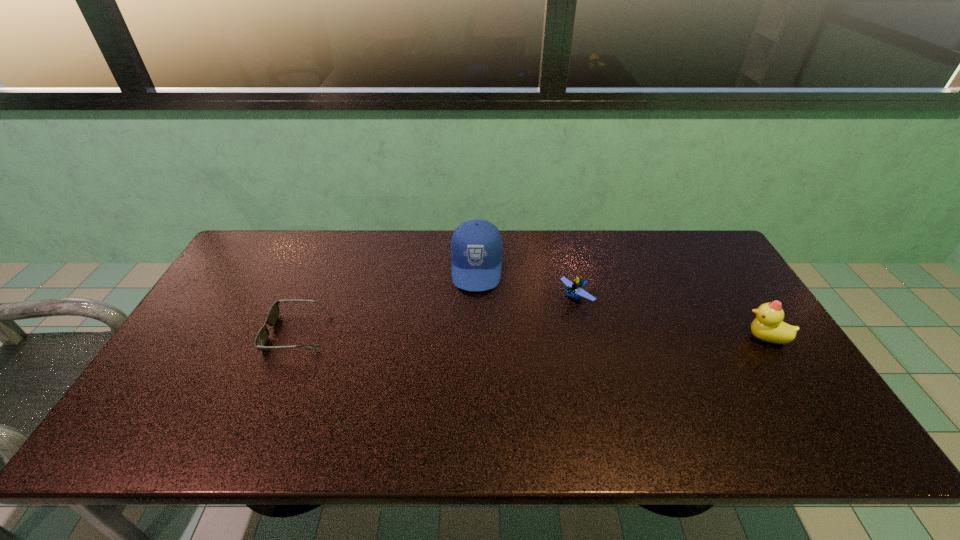
Locate an element on the screen. The height and width of the screenshot is (540, 960). free region that satisfies the following two spatial constraints: 1. on the front side of the third tallest object; 2. on the front-facing side of the rightmost object is located at coordinates (586, 338).